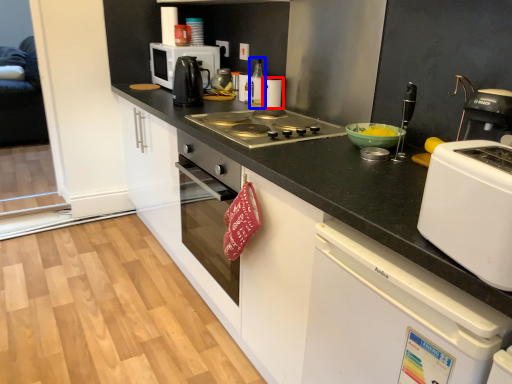
Question: Which object is further to the camera taking this photo, kitchen appliance (highlighted by a red box) or kitchen appliance (highlighted by a blue box)?

Choices:
 (A) kitchen appliance
 (B) kitchen appliance

Answer: (A)